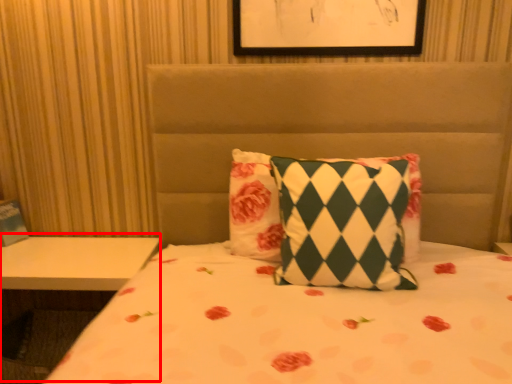
Question: From the image's perspective, what is the correct spatial relationship of table (annotated by the red box) in relation to pillow?

Choices:
 (A) above
 (B) below

Answer: (B)